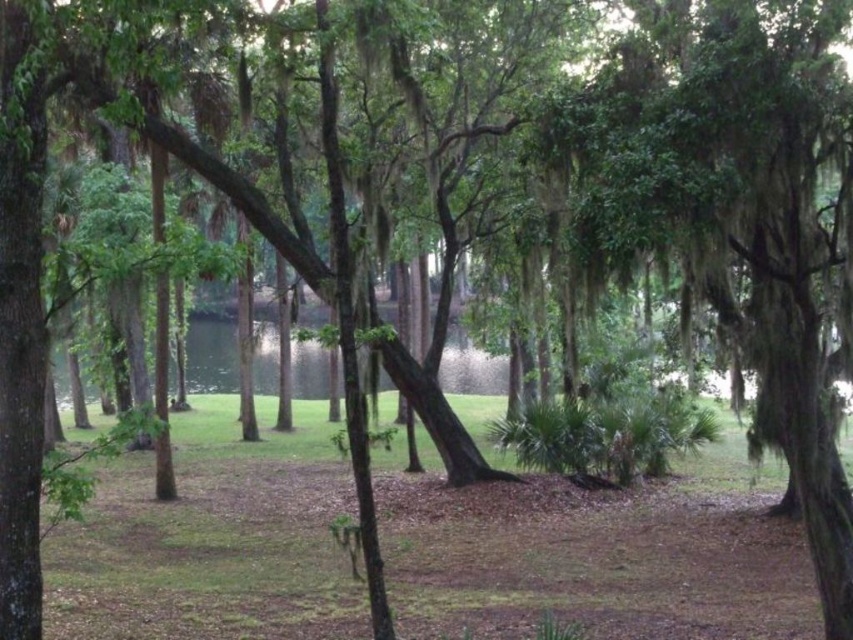
Can you confirm if green grass at center is taller than green mossy tree at center?

Incorrect, green grass at center's height is not larger of green mossy tree at center's.

This screenshot has width=853, height=640. What do you see at coordinates (596, 556) in the screenshot? I see `green grass at center` at bounding box center [596, 556].

Locate an element on the screen. green grass at center is located at coordinates (596, 556).